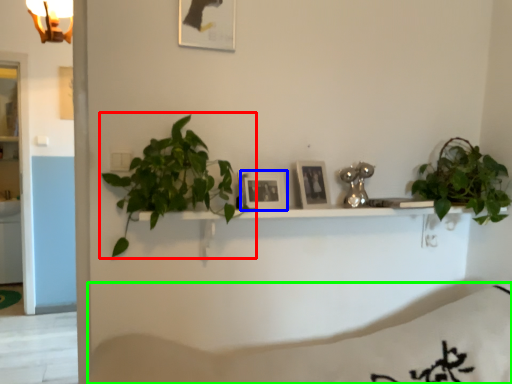
Question: Which object is the closest to the houseplant (highlighted by a red box)? Choose among these: picture frame (highlighted by a blue box) or bedding (highlighted by a green box).

Choices:
 (A) picture frame
 (B) bedding

Answer: (A)